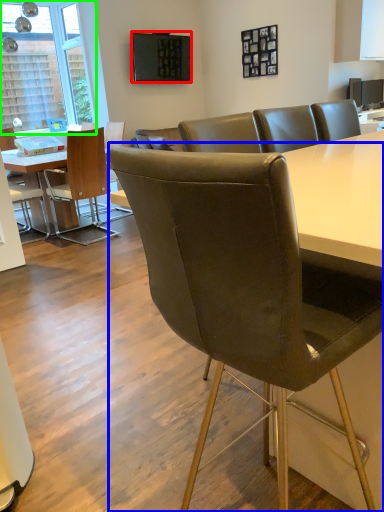
Question: Considering the real-world distances, which object is farthest from television (highlighted by a red box)? chair (highlighted by a blue box) or window (highlighted by a green box)?

Choices:
 (A) chair
 (B) window

Answer: (A)